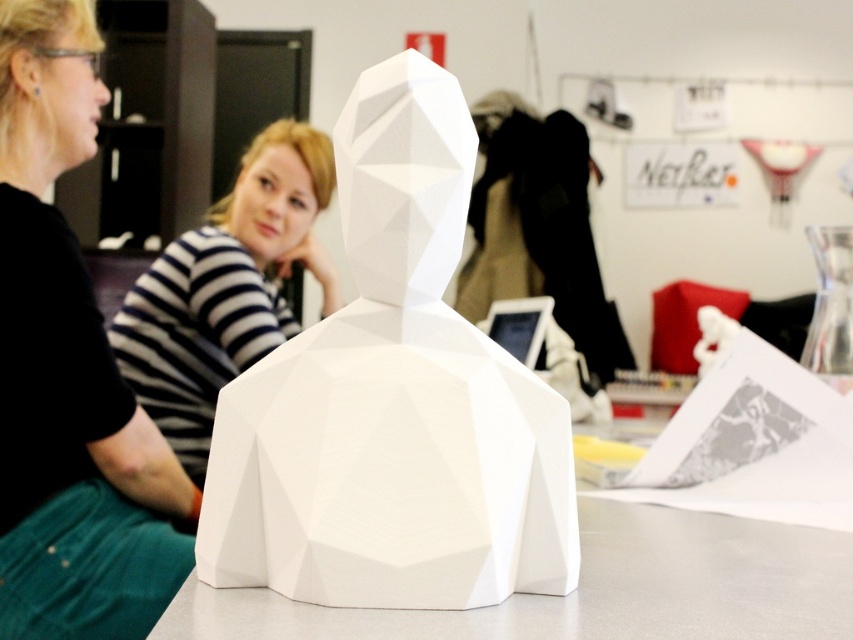
You are standing in the office and want to place a small vase on the table. The vase is 10 cm tall. The table has a height of 70 cm. Can you place the vase on the white matte table at center without it being obstructed by the striped shirt at center?

The white matte table at center is closer to the viewer than the striped shirt at center, so placing the vase on the table will not be obstructed by the striped shirt at center since the table is in front of the shirt.

You are sitting at the white matte table at center and want to hand a document to the person wearing the black matte shirt at center. Can you reach them directly without moving from your seat?

The white matte table at center is behind the black matte shirt at center, so you cannot reach them directly without moving from your seat.